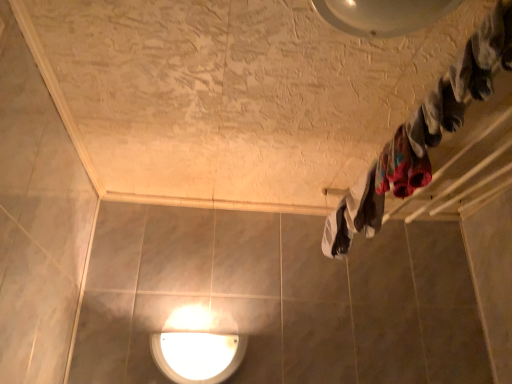
Question: Would you say white glossy light fixture at center is inside or outside multicolored fabric at upper right, the 2th clothing viewed from the back?

Choices:
 (A) outside
 (B) inside

Answer: (A)

Question: Is point click(198, 329) closer or farther from the camera than point click(395, 185)?

Choices:
 (A) closer
 (B) farther

Answer: (B)

Question: Based on their relative distances, which object is farther from the multicolored fabric at upper right, which appears as the first clothing when viewed from the front?

Choices:
 (A) white glossy light fixture at center
 (B) white fabric at center, which ranks as the 2th clothing in front-to-back order

Answer: (A)

Question: Estimate the real-world distances between objects in this image. Which object is closer to the multicolored fabric at upper right, which appears as the first clothing when viewed from the front?

Choices:
 (A) white fabric at center, the 1th clothing positioned from the back
 (B) white glossy light fixture at center

Answer: (A)